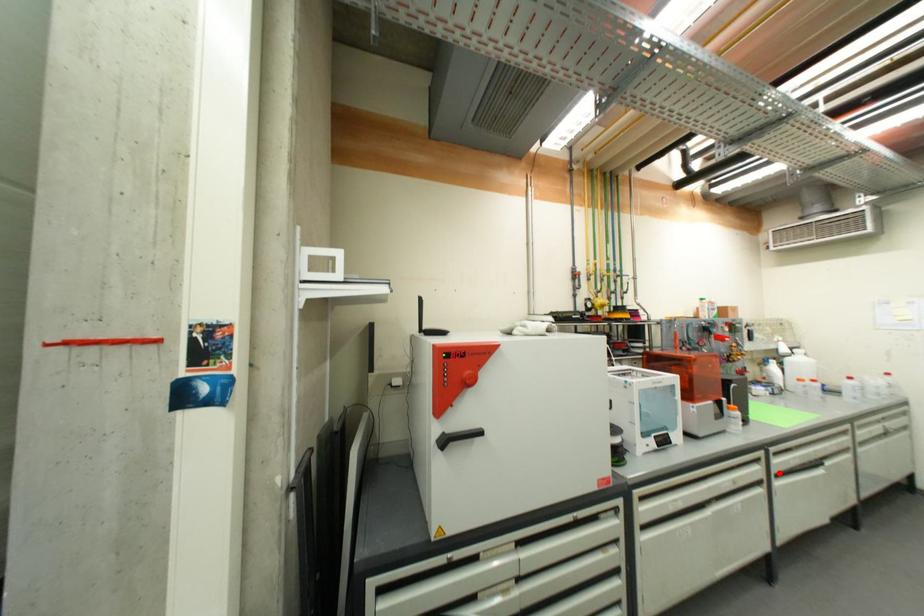
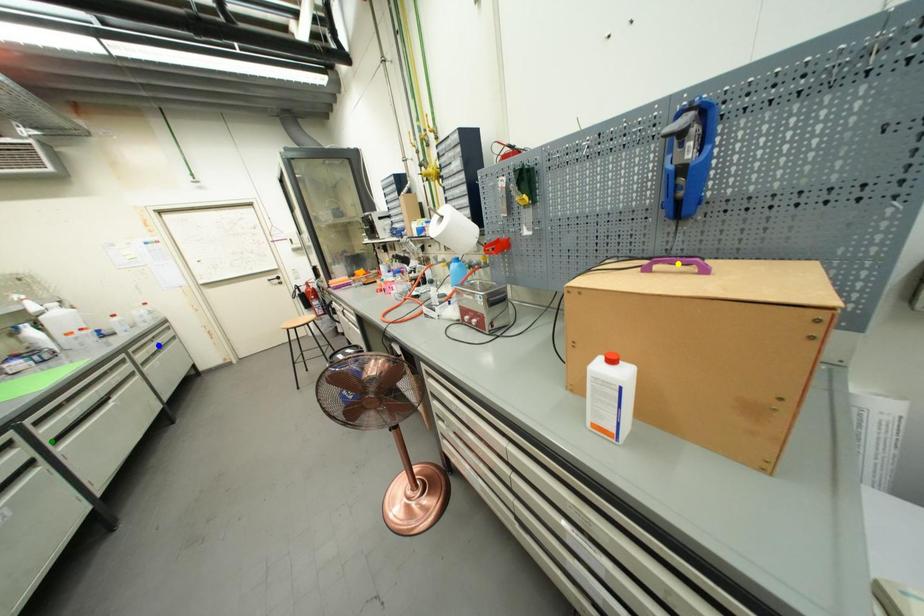
Question: I am providing you with two images of the same scene from different viewpoints. A red point is marked on the first image. You are given multiple points on the second image. Which point in image 2 represents the same 3d spot as the red point in image 1?

Choices:
 (A) green point
 (B) yellow point
 (C) blue point

Answer: (A)